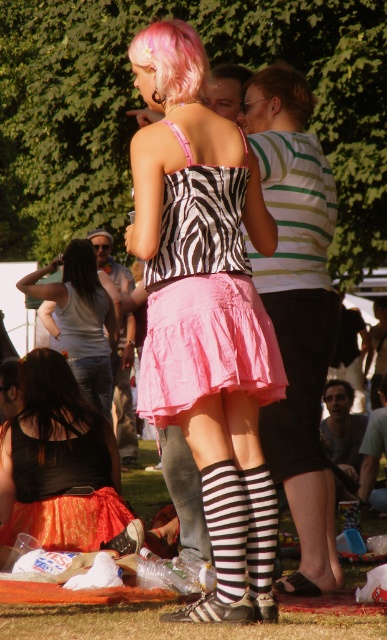
Is pink satin skirt at center closer to the viewer compared to pink hair at upper center?

Yes, it is in front of pink hair at upper center.

Who is taller, pink satin skirt at center or pink hair at upper center?

Standing taller between the two is pink satin skirt at center.

Between point (261, 316) and point (143, 42), which one is positioned behind?

Point (143, 42)

Where is `pink satin skirt at center`? This screenshot has height=640, width=387. pink satin skirt at center is located at coordinates (203, 298).

Which is below, zebra print tank top at center or black shiny hair at lower left?

Positioned lower is zebra print tank top at center.

How distant is zebra print tank top at center from black shiny hair at lower left?

zebra print tank top at center is 6.76 meters from black shiny hair at lower left.

Does point (193, 618) come closer to viewer compared to point (82, 292)?

Yes, point (193, 618) is in front of point (82, 292).

Identify the location of zebra print tank top at center. The height and width of the screenshot is (640, 387). (205, 310).

Who is taller, pink satin skirt at lower center or black shiny hair at lower left?

With more height is pink satin skirt at lower center.

Image resolution: width=387 pixels, height=640 pixels. I want to click on pink satin skirt at lower center, so click(x=82, y=320).